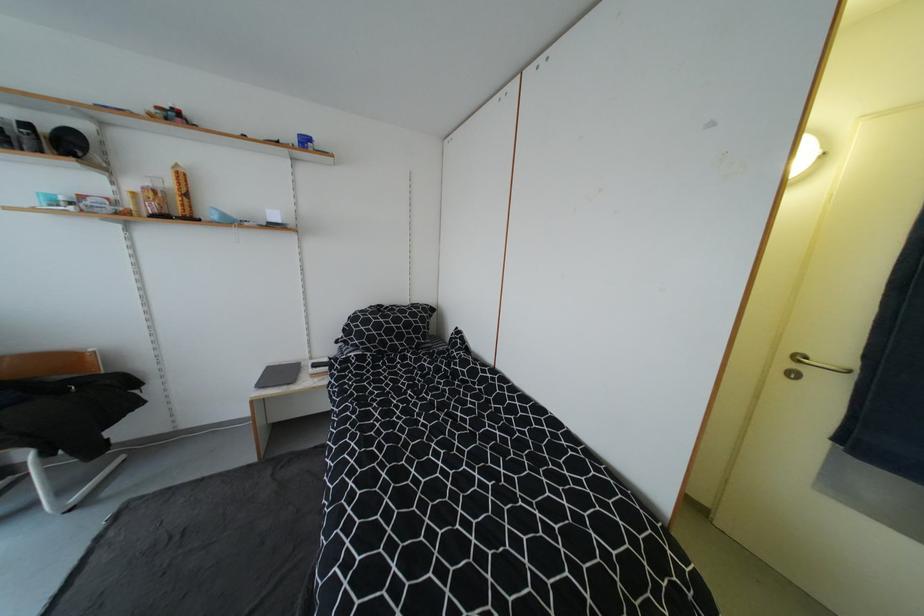
Describe the element at coordinates (153, 196) in the screenshot. The width and height of the screenshot is (924, 616). I see `the glass food jar` at that location.